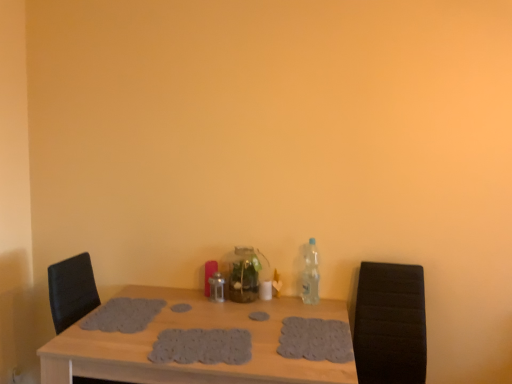
At what (x,y) coordinates should I click in order to perform the action: click on free space below gray knitted placemat at center, the third footprint viewed from the right (from a real-world perspective). Please return your answer as a coordinate pair (x, y). Looking at the image, I should click on (195, 346).